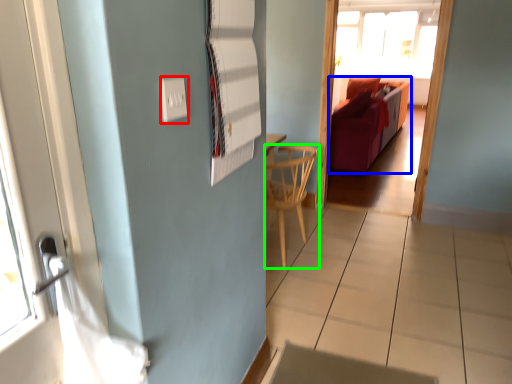
Question: Which object is the farthest from electric outlet (highlighted by a red box)? Choose among these: furniture (highlighted by a blue box) or chair (highlighted by a green box).

Choices:
 (A) furniture
 (B) chair

Answer: (A)